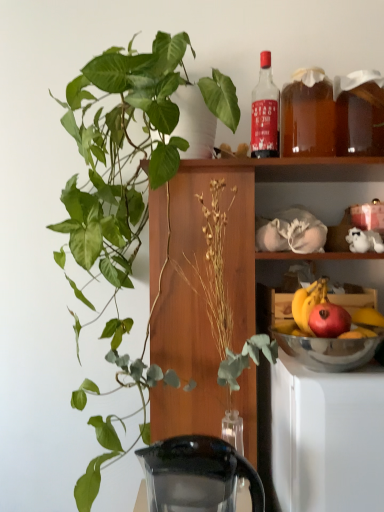
Question: Considering the relative sizes of translucent amber liquid at upper right, acting as the second beverage starting from the right, and green glossy plant at upper left in the image provided, is translucent amber liquid at upper right, acting as the second beverage starting from the right, smaller than green glossy plant at upper left?

Choices:
 (A) no
 (B) yes

Answer: (B)

Question: Is translucent amber liquid at upper right, which is the first beverage from left to right, aimed at green glossy plant at upper left?

Choices:
 (A) yes
 (B) no

Answer: (B)

Question: Can you confirm if translucent amber liquid at upper right, which is the first beverage from left to right, is shorter than green glossy plant at upper left?

Choices:
 (A) no
 (B) yes

Answer: (B)

Question: Considering the relative sizes of translucent amber liquid at upper right, acting as the second beverage starting from the right, and green glossy plant at upper left in the image provided, is translucent amber liquid at upper right, acting as the second beverage starting from the right, bigger than green glossy plant at upper left?

Choices:
 (A) yes
 (B) no

Answer: (B)

Question: Considering the relative sizes of translucent amber liquid at upper right, which is the first beverage from left to right, and green glossy plant at upper left in the image provided, is translucent amber liquid at upper right, which is the first beverage from left to right, taller than green glossy plant at upper left?

Choices:
 (A) yes
 (B) no

Answer: (B)

Question: From the image's perspective, relative to green glossy plant at upper left, is translucent amber liquid at shelf right, the 2th beverage positioned from the left, above or below?

Choices:
 (A) above
 (B) below

Answer: (A)

Question: Is translucent amber liquid at shelf right, the 2th beverage positioned from the left, in front of or behind green glossy plant at upper left in the image?

Choices:
 (A) behind
 (B) front

Answer: (A)

Question: Does point (369, 105) appear closer or farther from the camera than point (99, 186)?

Choices:
 (A) farther
 (B) closer

Answer: (B)

Question: Considering the positions of translucent amber liquid at shelf right, the 2th beverage positioned from the left, and green glossy plant at upper left in the image, is translucent amber liquid at shelf right, the 2th beverage positioned from the left, bigger or smaller than green glossy plant at upper left?

Choices:
 (A) big
 (B) small

Answer: (B)

Question: Is wooden cabinet at center wider or thinner than shiny metallic bowl at lower right?

Choices:
 (A) wide
 (B) thin

Answer: (A)

Question: From their relative heights in the image, would you say wooden cabinet at center is taller or shorter than shiny metallic bowl at lower right?

Choices:
 (A) tall
 (B) short

Answer: (A)

Question: Considering the positions of wooden cabinet at center and shiny metallic bowl at lower right in the image, is wooden cabinet at center bigger or smaller than shiny metallic bowl at lower right?

Choices:
 (A) small
 (B) big

Answer: (B)

Question: Is wooden cabinet at center in front of or behind shiny metallic bowl at lower right in the image?

Choices:
 (A) behind
 (B) front

Answer: (B)

Question: From the image's perspective, is red matte apple at right above or below silver metallic bowl at lower right?

Choices:
 (A) above
 (B) below

Answer: (A)

Question: Is red matte apple at right taller or shorter than silver metallic bowl at lower right?

Choices:
 (A) short
 (B) tall

Answer: (B)